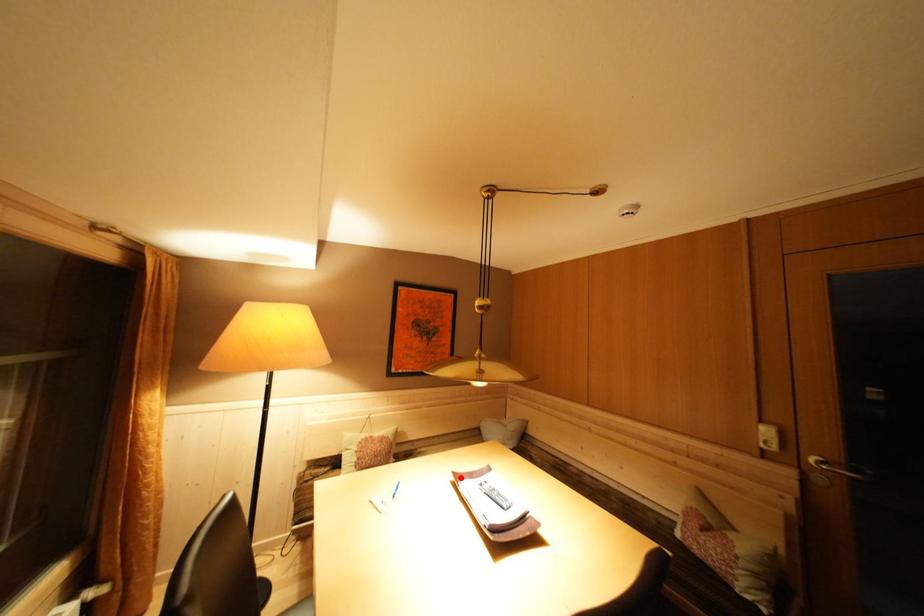
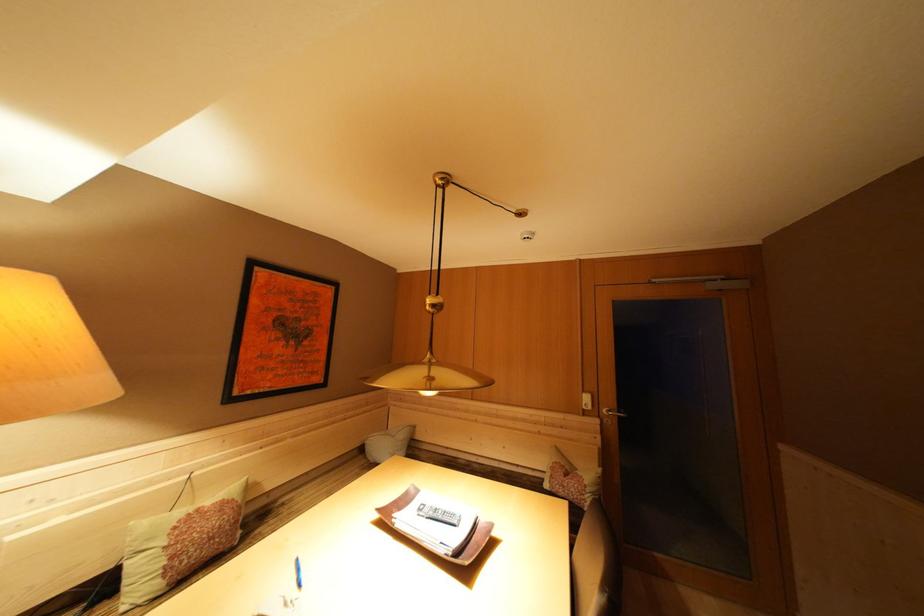
Question: I am providing you with two images of the same scene from different viewpoints. A red point is shown in image1. For the corresponding object point in image2, is it positioned nearer or farther from the camera?

Choices:
 (A) Nearer
 (B) Farther

Answer: (B)